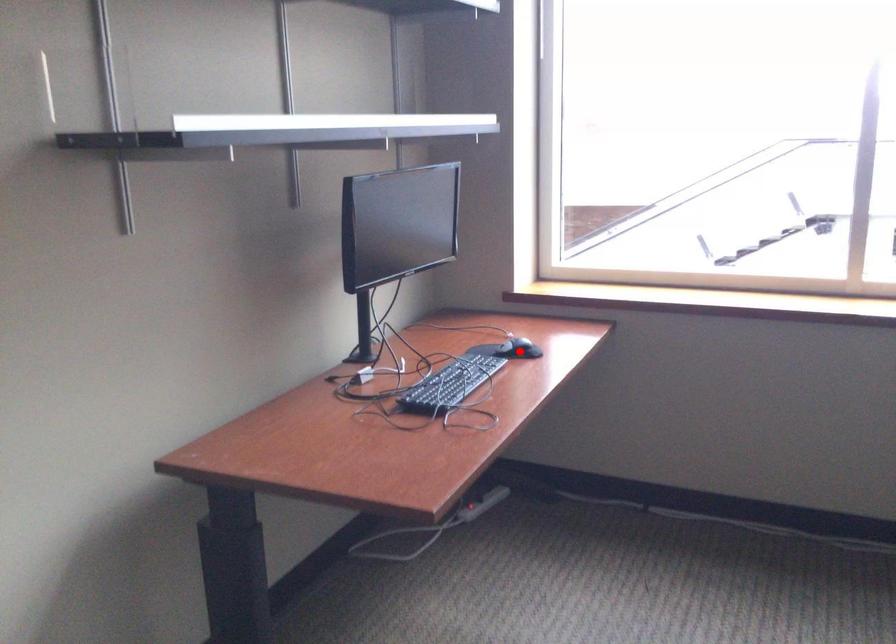
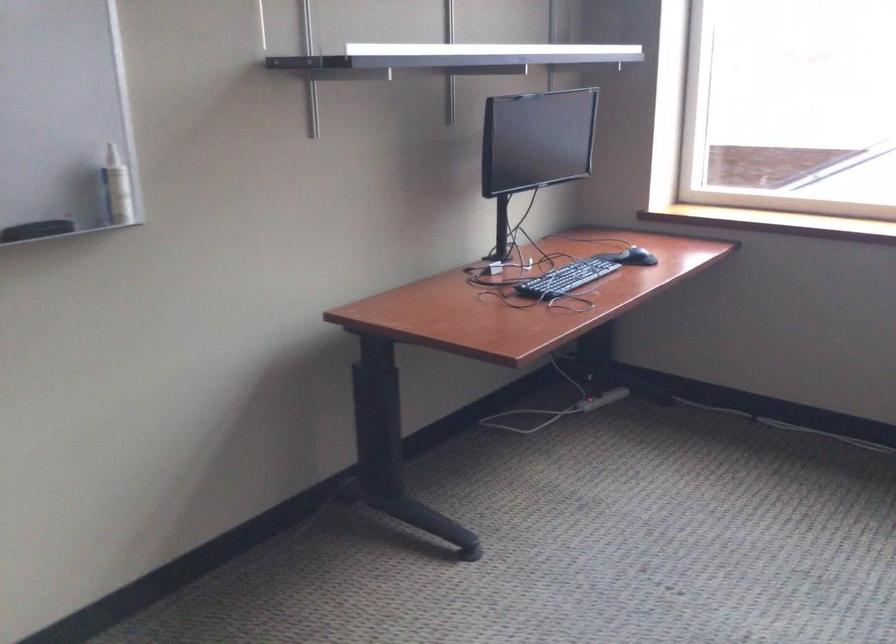
Question: I am providing you with two images of the same scene from different viewpoints. Given a red point in image1, look at the same physical point in image2. Is it:

Choices:
 (A) Closer to the viewpoint
 (B) Farther from the viewpoint

Answer: (B)